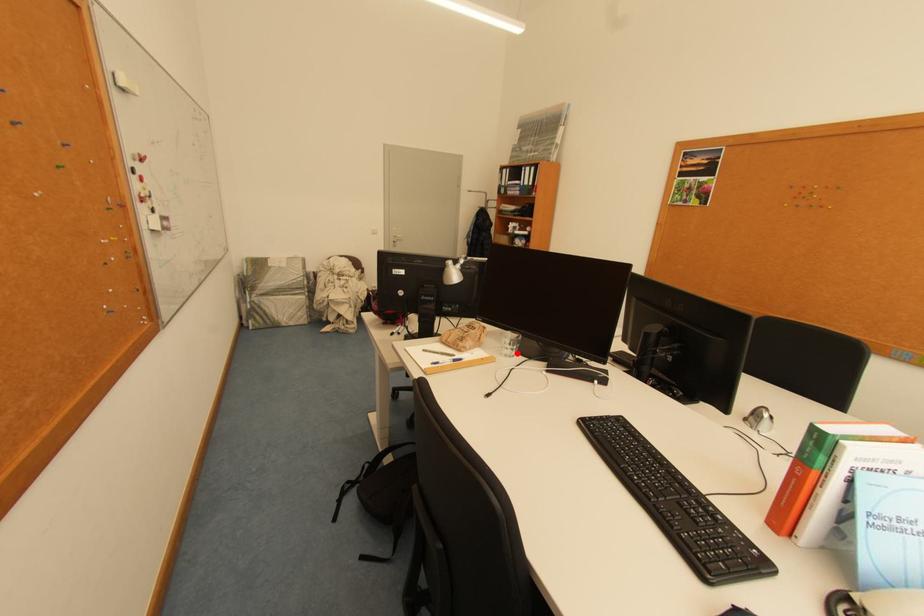
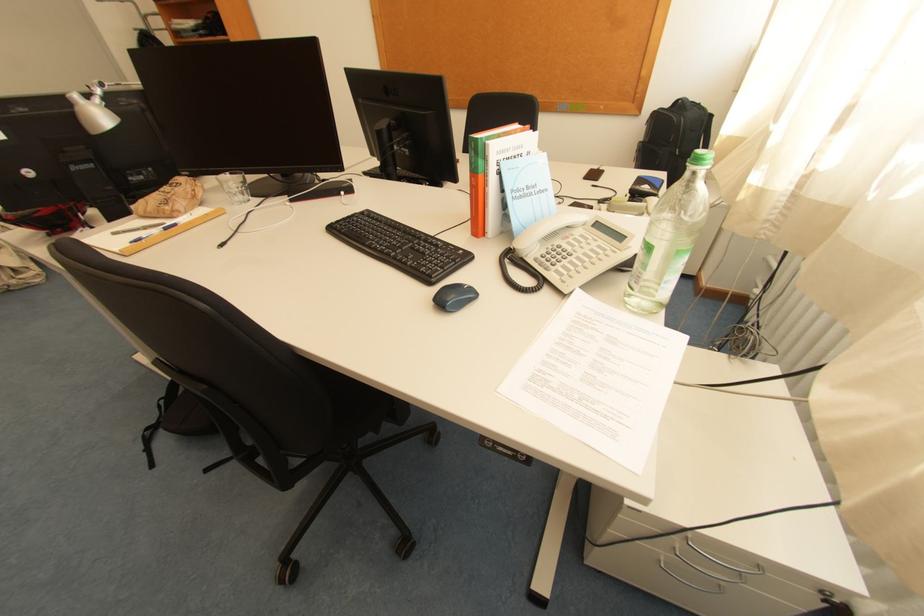
Find the pixel in the second image that matches the highlighted location in the first image.

(248, 198)